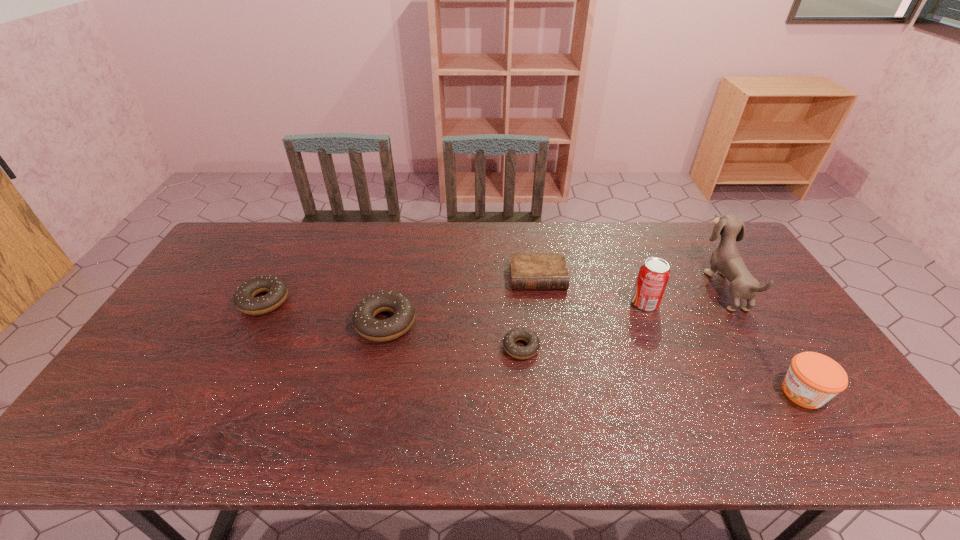
Please point out where to position a new doughnut on the right to maintain spacing. Please provide its 2D coordinates. Your answer should be formatted as a tuple, i.e. [(x, y)], where the tuple contains the x and y coordinates of a point satisfying the conditions above.

[(673, 375)]